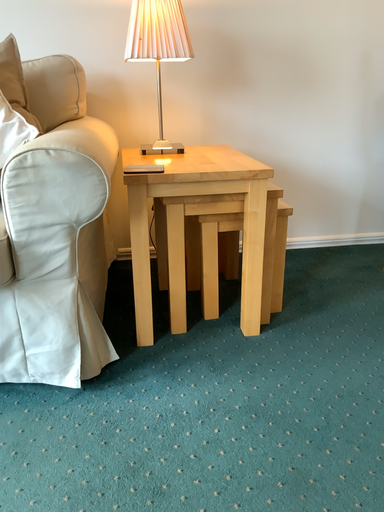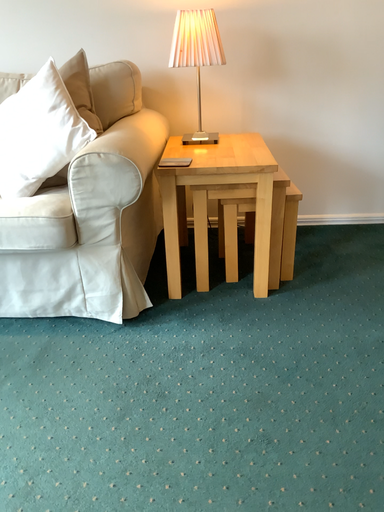
Question: How did the camera likely rotate when shooting the video?

Choices:
 (A) rotated left
 (B) rotated right

Answer: (A)